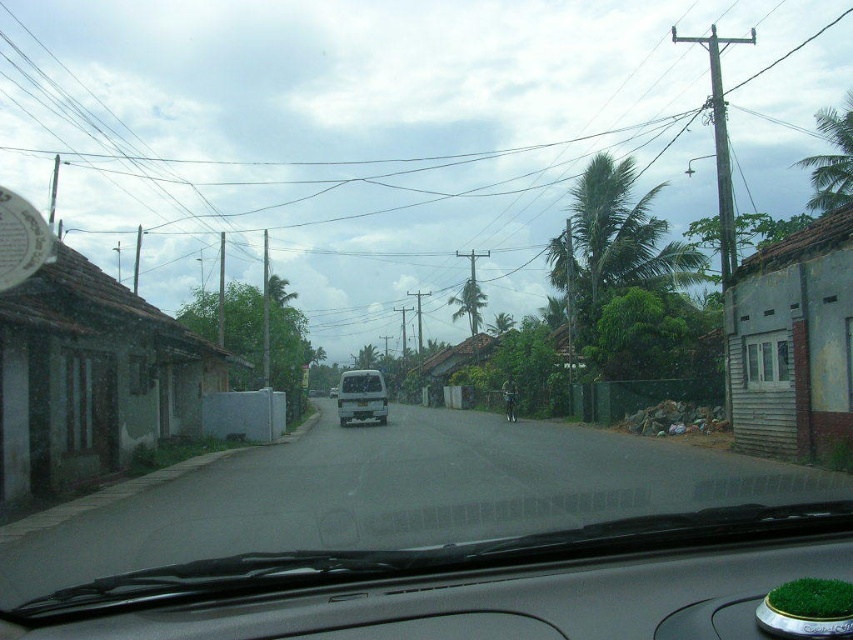
Is green leafy palm tree at upper right further to the viewer compared to clear glass windshield at center?

No, green leafy palm tree at upper right is closer to the viewer.

Does green leafy palm tree at upper right appear over clear glass windshield at center?

Correct, green leafy palm tree at upper right is located above clear glass windshield at center.

Where is `green leafy palm tree at upper right`? green leafy palm tree at upper right is located at coordinates (831, 160).

The image size is (853, 640). I want to click on green leafy palm tree at upper right, so click(831, 160).

Can you confirm if white matte van at center is shorter than green leafy palm tree at center?

Indeed, white matte van at center has a lesser height compared to green leafy palm tree at center.

Does white matte van at center have a larger size compared to green leafy palm tree at center?

Actually, white matte van at center might be smaller than green leafy palm tree at center.

Which is behind, point (370, 380) or point (450, 296)?

Point (450, 296)

Locate an element on the screen. white matte van at center is located at coordinates (361, 396).

Is point (363, 404) in front of point (350, 380)?

That is True.

Is white matte van at center taller than clear glass windshield at center?

Correct, white matte van at center is much taller as clear glass windshield at center.

The height and width of the screenshot is (640, 853). What do you see at coordinates (361, 396) in the screenshot? I see `white matte van at center` at bounding box center [361, 396].

Image resolution: width=853 pixels, height=640 pixels. What are the coordinates of `white matte van at center` in the screenshot? It's located at (361, 396).